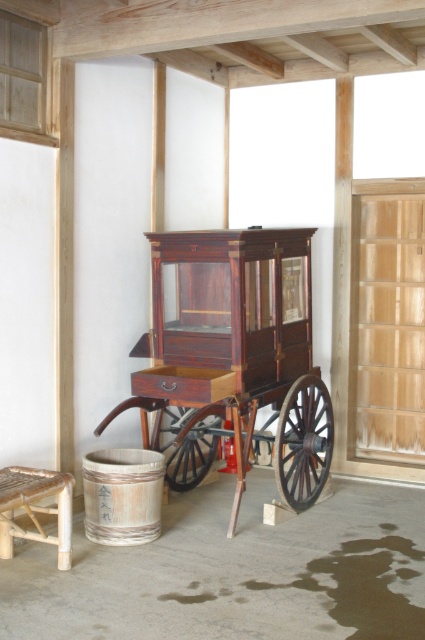
Between point (189, 348) and point (39, 524), which one is positioned in front?

Positioned in front is point (39, 524).

Image resolution: width=425 pixels, height=640 pixels. Find the location of `mahogany wood wagon at center`. mahogany wood wagon at center is located at coordinates (232, 356).